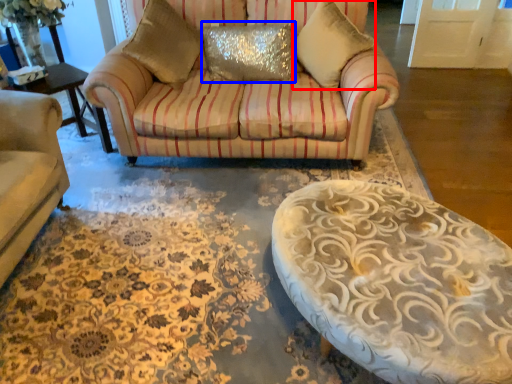
Question: Which of the following is the farthest to the observer, pillow (highlighted by a red box) or pillow (highlighted by a blue box)?

Choices:
 (A) pillow
 (B) pillow

Answer: (B)